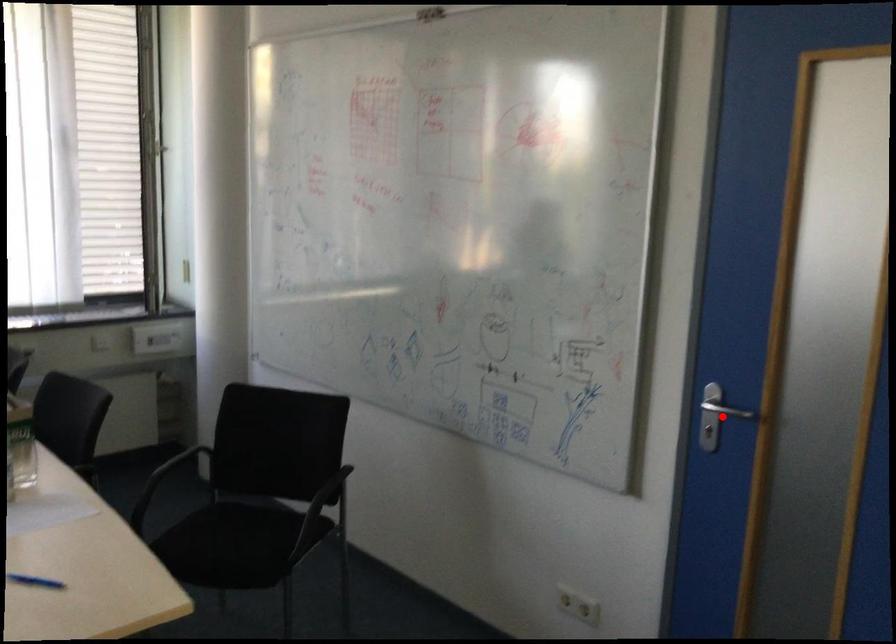
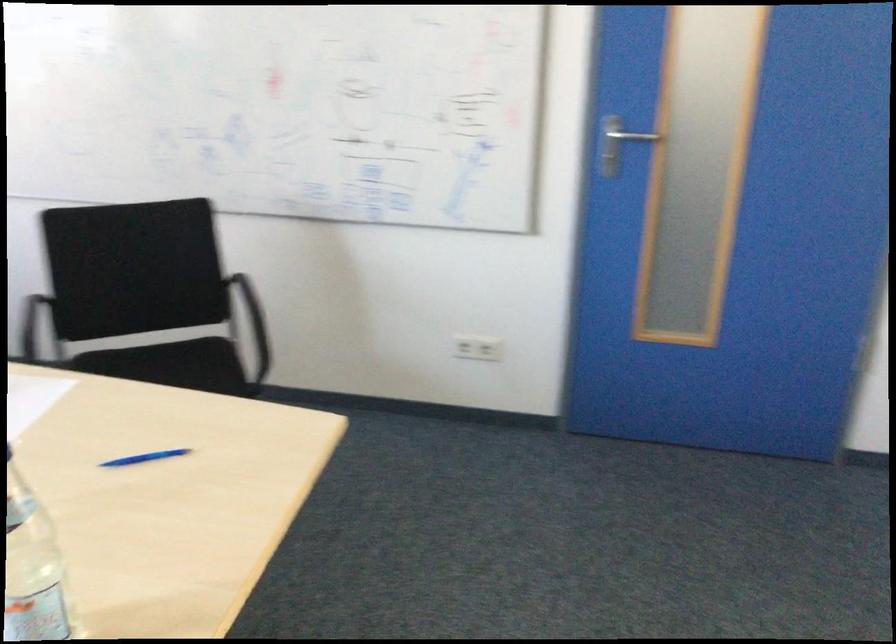
Question: I am providing you with two images of the same scene from different viewpoints. A red point is marked on the first image. Can you still see the location of the red point in image 2?

Choices:
 (A) Yes
 (B) No

Answer: (A)